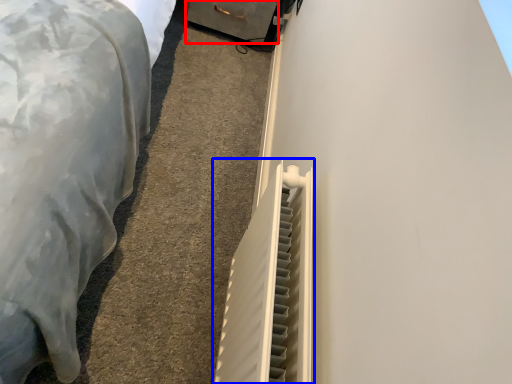
Question: Which object appears farthest to the camera in this image, drawer (highlighted by a red box) or radiator (highlighted by a blue box)?

Choices:
 (A) drawer
 (B) radiator

Answer: (A)